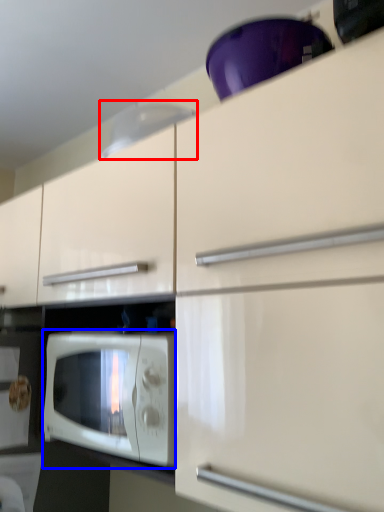
Question: Which of the following is the closest to the observer, exhaust hood (highlighted by a red box) or microwave oven (highlighted by a blue box)?

Choices:
 (A) exhaust hood
 (B) microwave oven

Answer: (B)